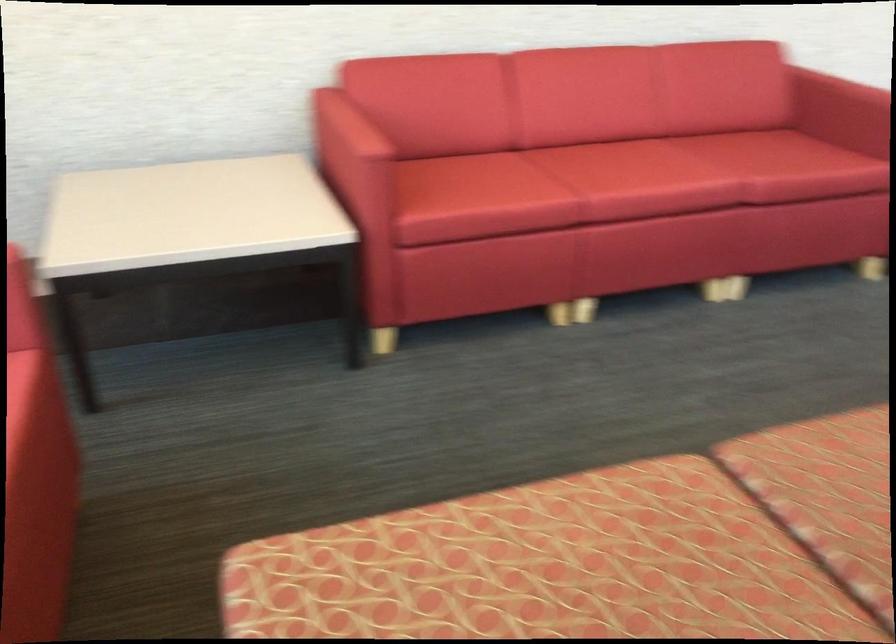
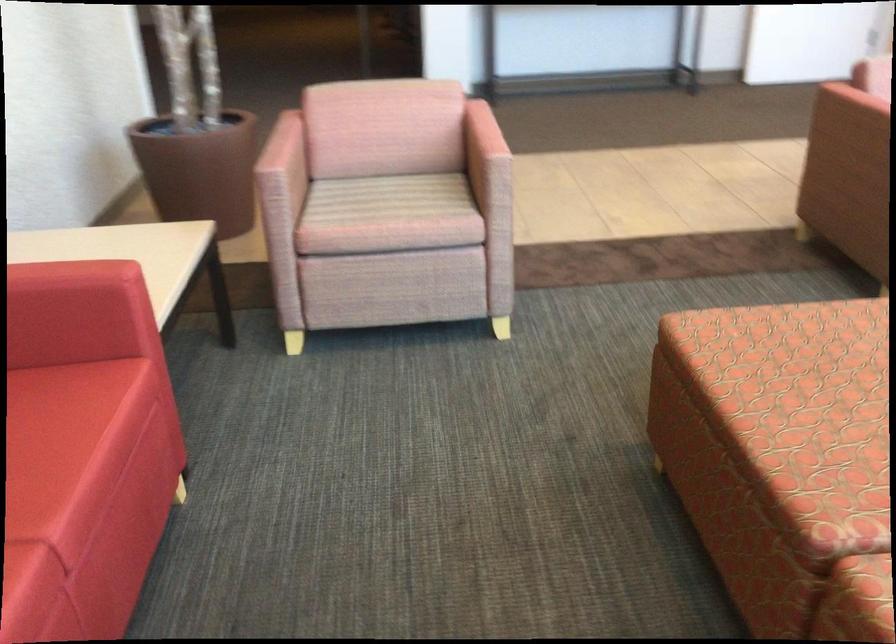
Where in the second image is the point corresponding to point (810, 149) from the first image?

(38, 408)